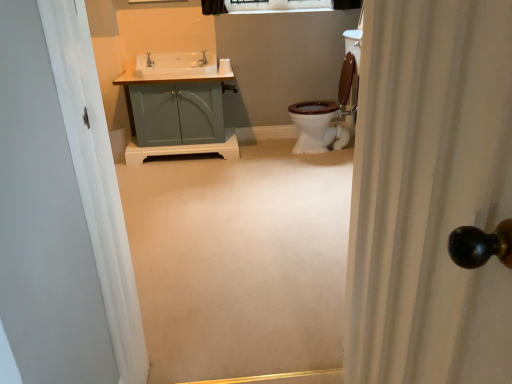
Question: Is matte silver faucet at upper left wider or thinner than clear glass window at upper center?

Choices:
 (A) wide
 (B) thin

Answer: (A)

Question: Considering the positions of matte silver faucet at upper left and clear glass window at upper center in the image, is matte silver faucet at upper left bigger or smaller than clear glass window at upper center?

Choices:
 (A) big
 (B) small

Answer: (B)

Question: Which object is positioned closest to the matte silver faucet at upper left?

Choices:
 (A) matte silver faucet at upper center
 (B) white textured shower curtain at right
 (C) clear glass window at upper center
 (D) matte teal cabinet at center
 (E) white glossy sink at upper left

Answer: (E)

Question: Considering the real-world distances, which object is closest to the matte silver faucet at upper left?

Choices:
 (A) white glossy sink at upper left
 (B) white matte toilet paper at upper center
 (C) matte teal cabinet at center
 (D) white textured shower curtain at right
 (E) matte silver faucet at upper center

Answer: (A)